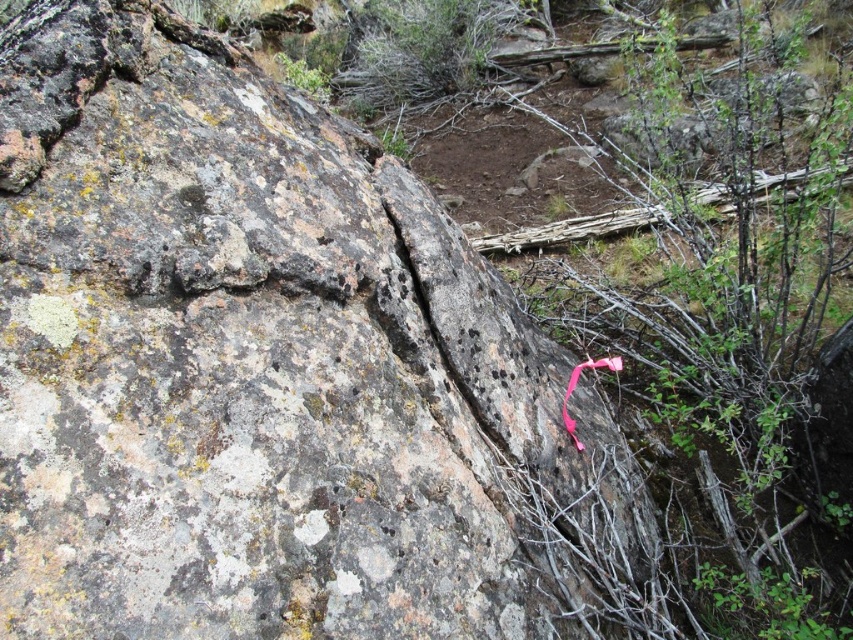
Consider the image. You are a hiker who has just found two pink items in the rugged outdoor scene. You need to decide which one to take with you. The pink fabric at center and the pink fabric ribbon at lower right are both visible. Which item is larger and thus easier to carry?

The pink fabric at center is bigger than the pink fabric ribbon at lower right, so it is larger and easier to carry.

You are an outdoor photographer setting up a shot. You have a pink fabric at center and a pink fabric ribbon at lower right in your frame. Which object should you adjust to align them vertically? Explain your reasoning.

The pink fabric at center is to the right of the pink fabric ribbon at lower right. To align them vertically, you should move the pink fabric ribbon at lower right to the right until it matches the horizontal position of the pink fabric at center.